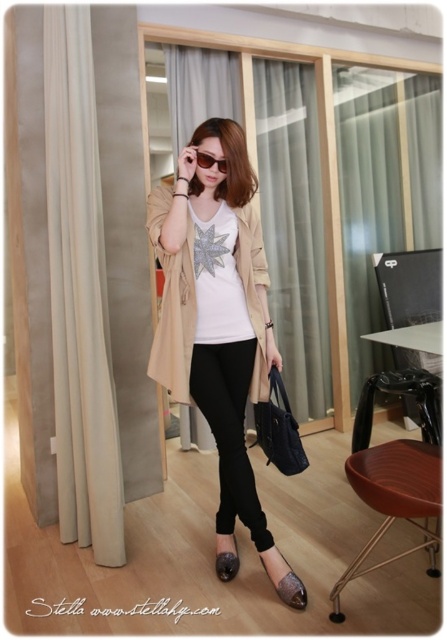
Question: Estimate the real-world distances between objects in this image. Which object is farther from the beige fabric coat at center?

Choices:
 (A) leather-like metallic sandal at lower center
 (B) matte beige cardigan at center
 (C) brown wood stool at lower right

Answer: (A)

Question: Which object appears closest to the camera in this image?

Choices:
 (A) matte black sandal at lower center
 (B) beige fabric coat at center
 (C) matte beige cardigan at center
 (D) leather-like metallic sandal at lower center

Answer: (C)

Question: Considering the real-world distances, which object is farthest from the sunglasses at center?

Choices:
 (A) brown wood stool at lower right
 (B) matte black sandal at lower center
 (C) matte beige cardigan at center

Answer: (B)

Question: Can you confirm if beige fabric coat at center is bigger than matte black sandal at lower center?

Choices:
 (A) yes
 (B) no

Answer: (A)

Question: Is matte beige cardigan at center above leather-like metallic sandal at lower center?

Choices:
 (A) yes
 (B) no

Answer: (A)

Question: Does matte beige cardigan at center have a greater width compared to beige fabric coat at center?

Choices:
 (A) yes
 (B) no

Answer: (A)